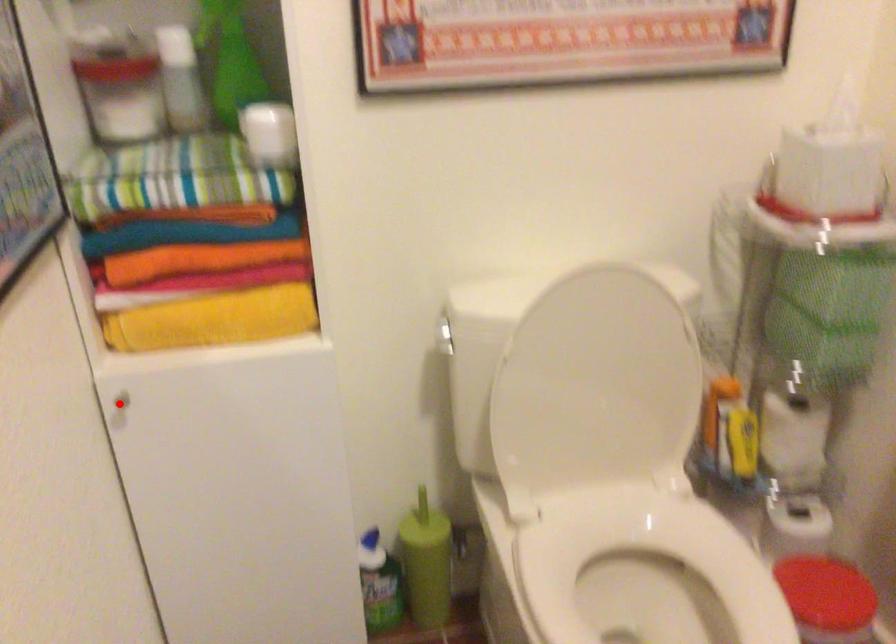
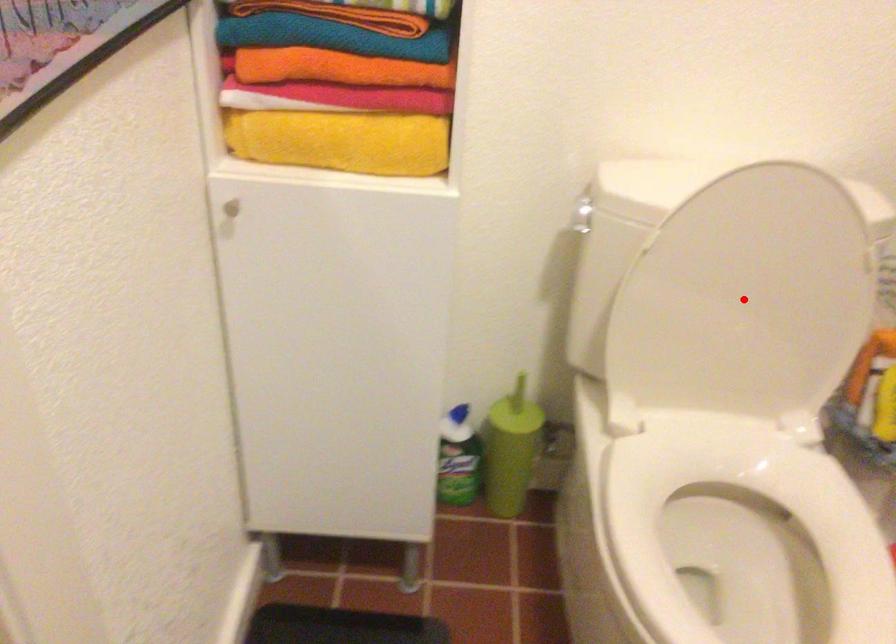
I am providing you with two images of the same scene from different viewpoints. A red point is marked on the first image and another point is marked on the second image. Are the points marked in image1 and image2 representing the same 3D position?

No